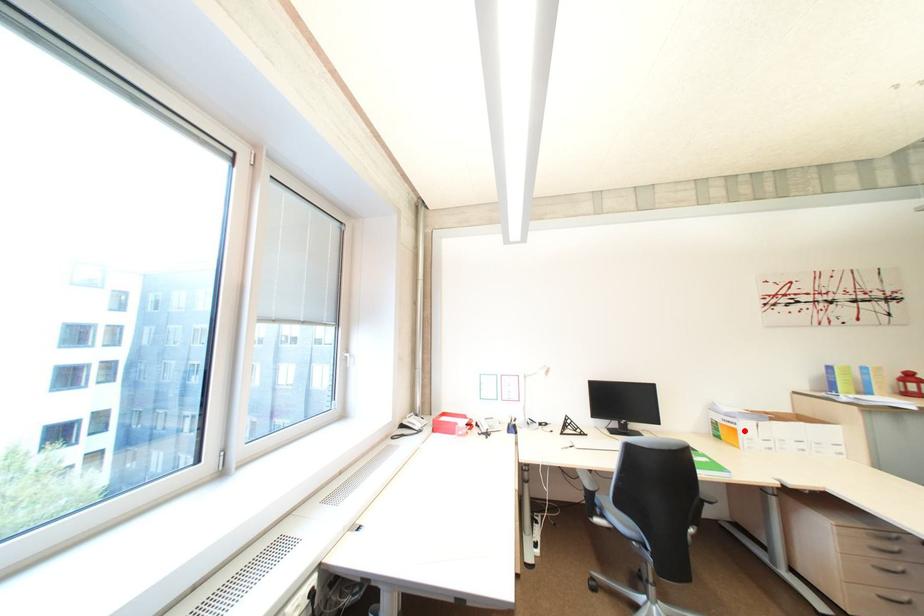
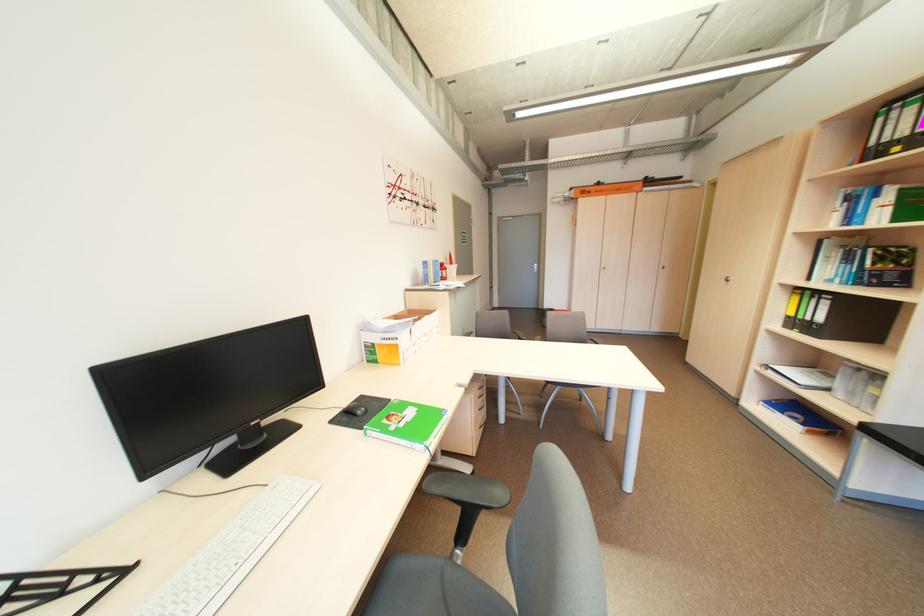
Locate, in the second image, the point that corresponds to the highlighted location in the first image.

(406, 347)